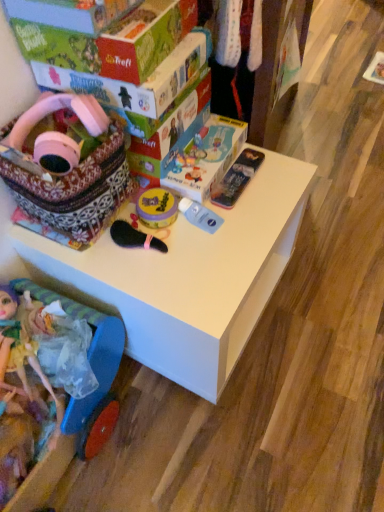
I want to click on vacant space to the right of white matte table at center, so click(324, 300).